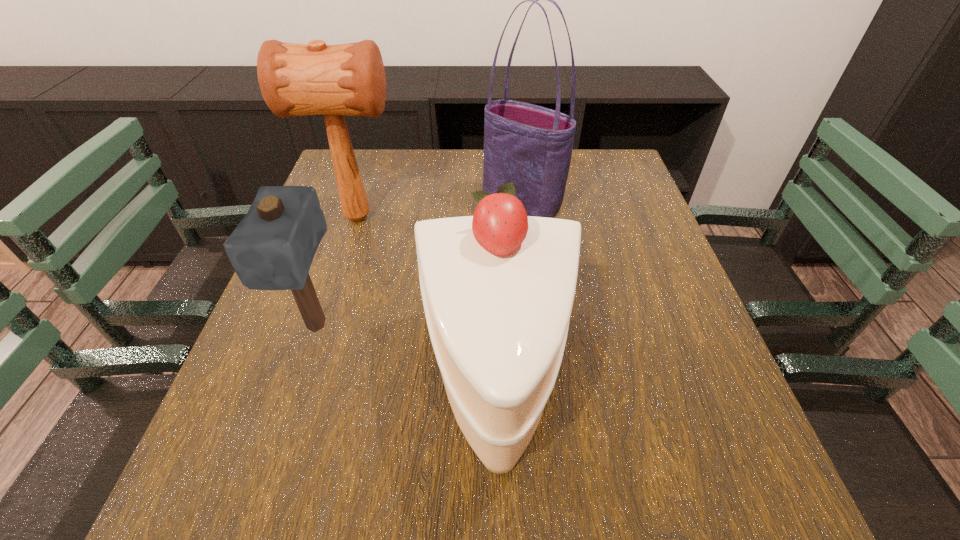
Locate an element on the screen. Image resolution: width=960 pixels, height=540 pixels. vacant position in the image that satisfies the following two spatial constraints: 1. on the back side of the nearer mallet; 2. on the right side of the tote bag is located at coordinates (357, 203).